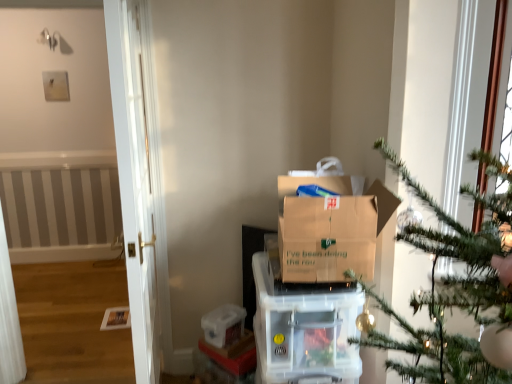
Question: Are transparent plastic container at lower center and brown cardboard box at center located far from each other?

Choices:
 (A) yes
 (B) no

Answer: (B)

Question: Considering the relative positions of transparent plastic container at lower center and brown cardboard box at center in the image provided, is transparent plastic container at lower center to the left of brown cardboard box at center from the viewer's perspective?

Choices:
 (A) no
 (B) yes

Answer: (B)

Question: From the image's perspective, is transparent plastic container at lower center over brown cardboard box at center?

Choices:
 (A) yes
 (B) no

Answer: (B)

Question: Is transparent plastic container at lower center taller than brown cardboard box at center?

Choices:
 (A) yes
 (B) no

Answer: (B)

Question: Can you confirm if transparent plastic container at lower center is bigger than brown cardboard box at center?

Choices:
 (A) yes
 (B) no

Answer: (B)

Question: Looking at their shapes, would you say clear plastic storage container at center is wider or thinner than brown cardboard box at center?

Choices:
 (A) wide
 (B) thin

Answer: (A)

Question: Considering the relative positions of clear plastic storage container at center and brown cardboard box at center in the image provided, is clear plastic storage container at center to the left or to the right of brown cardboard box at center?

Choices:
 (A) right
 (B) left

Answer: (B)

Question: Is clear plastic storage container at center taller or shorter than brown cardboard box at center?

Choices:
 (A) short
 (B) tall

Answer: (A)

Question: Is point click(x=355, y=350) positioned closer to the camera than point click(x=286, y=220)?

Choices:
 (A) closer
 (B) farther

Answer: (B)

Question: Is brown cardboard box at center wider or thinner than transparent plastic container at lower center?

Choices:
 (A) wide
 (B) thin

Answer: (A)

Question: Is brown cardboard box at center inside or outside of transparent plastic container at lower center?

Choices:
 (A) inside
 (B) outside

Answer: (B)

Question: From the image's perspective, is brown cardboard box at center above or below transparent plastic container at lower center?

Choices:
 (A) below
 (B) above

Answer: (B)

Question: Does point (280, 190) appear closer or farther from the camera than point (206, 324)?

Choices:
 (A) closer
 (B) farther

Answer: (A)

Question: From a real-world perspective, relative to clear plastic storage container at center, is brown cardboard box at center vertically above or below?

Choices:
 (A) below
 (B) above

Answer: (B)

Question: Do you think brown cardboard box at center is within clear plastic storage container at center, or outside of it?

Choices:
 (A) outside
 (B) inside

Answer: (A)